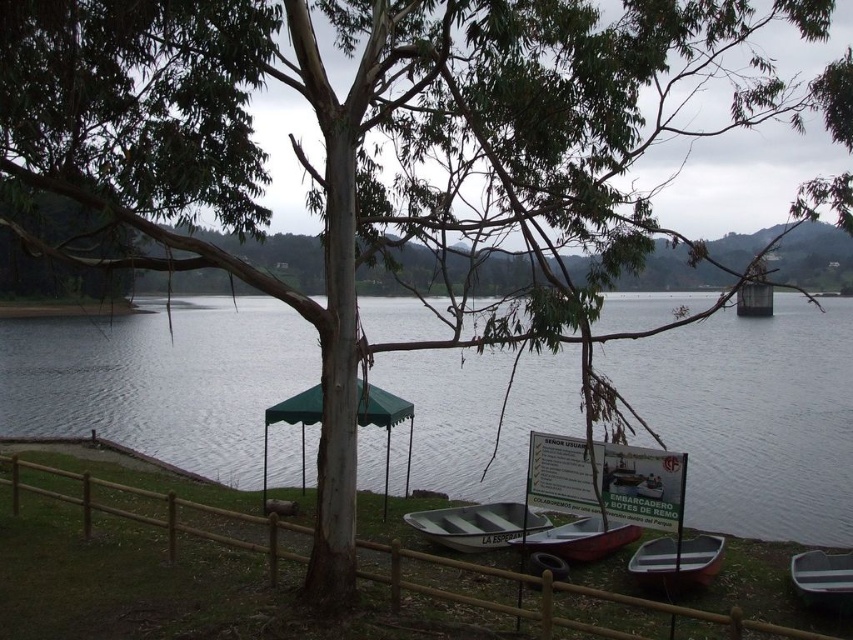
Is white striped boat at center positioned behind green plastic boat at lower right?

That is True.

Between white striped boat at center and green plastic boat at lower right, which one appears on the right side from the viewer's perspective?

green plastic boat at lower right is more to the right.

Between point (457, 550) and point (811, 604), which one is positioned in front?

Point (811, 604) is more forward.

Locate an element on the screen. Image resolution: width=853 pixels, height=640 pixels. white striped boat at center is located at coordinates (476, 524).

Based on the photo, does transparent water at center have a smaller size compared to white striped boat at center?

Incorrect, transparent water at center is not smaller in size than white striped boat at center.

Locate an element on the screen. The height and width of the screenshot is (640, 853). transparent water at center is located at coordinates (753, 417).

Find the location of `transparent water at center`. transparent water at center is located at coordinates (753, 417).

Is transparent water at center wider than white plastic canoe at center?

Yes, transparent water at center is wider than white plastic canoe at center.

Who is shorter, transparent water at center or white plastic canoe at center?

white plastic canoe at center is shorter.

You are a GUI agent. You are given a task and a screenshot of the screen. Output one action in this format:
    pyautogui.click(x=<x>, y=<y>)
    Task: Click on the transparent water at center
    The height and width of the screenshot is (640, 853).
    Given the screenshot: What is the action you would take?
    pyautogui.click(x=753, y=417)

Locate an element on the screen. transparent water at center is located at coordinates (753, 417).